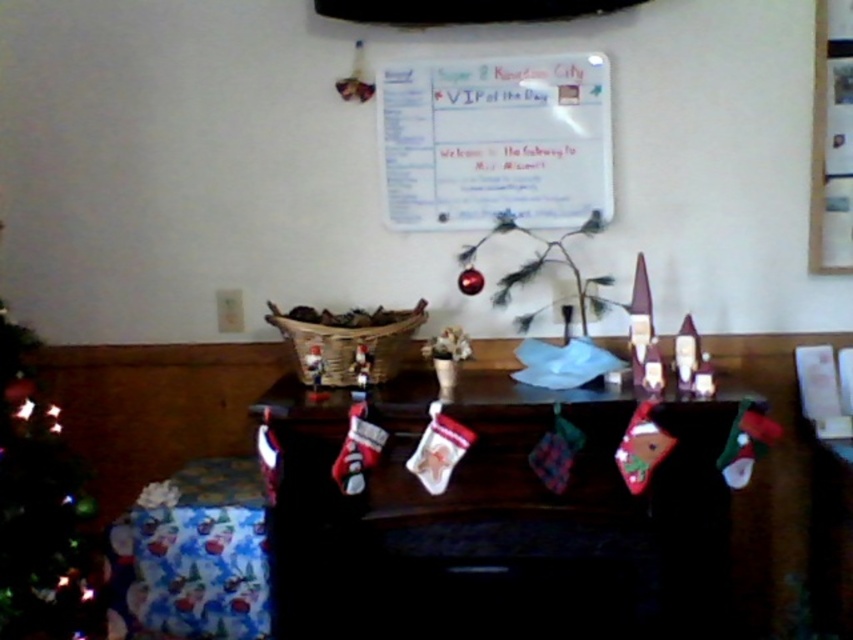
You are a guest entering the living room and want to see both the velvet red stockings at center and the wooden picture frame at upper right. Which object will you see first when you walk into the room?

The velvet red stockings at center will be seen first because it is positioned in front of the wooden picture frame at upper right, making it more visible upon entering.

You are planning to place a new ornament between the green matte christmas tree at left and the wooden picture frame at upper right. The ornament requires at least 1.5 meters of space between them to be placed safely. Can you place it there?

The distance between the green matte christmas tree at left and the wooden picture frame at upper right is 2.09 meters, which is more than the required 1.5 meters. Therefore, you can safely place the ornament between them.

You are a guest in the living room and want to place a small gift under the green matte christmas tree at left. However, there are velvet red stockings at center in the way. Can you place the gift directly under the tree without moving the stockings?

The velvet red stockings at center are located below the green matte christmas tree at left, so the stockings are hanging from the table where the tree is placed. Since the stockings are hanging below the tree, there is no space to place the gift directly under the tree without moving the stockings.